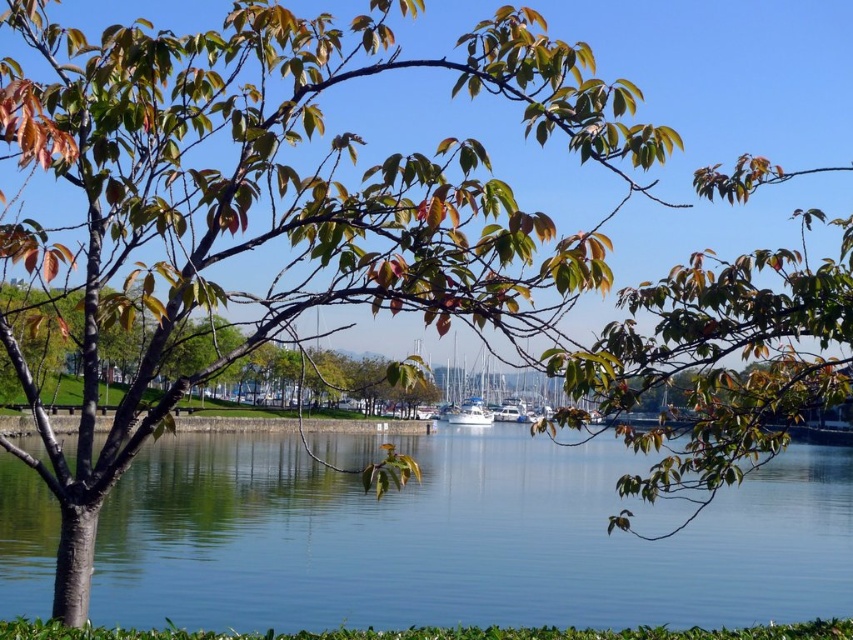
Question: Which object is the farthest from the green matte tree at center?

Choices:
 (A) clear blue water at center
 (B) white glossy boat at center

Answer: (A)

Question: Does clear blue water at center have a larger size compared to white glossy boat at center?

Choices:
 (A) yes
 (B) no

Answer: (A)

Question: Which object is farther from the camera taking this photo?

Choices:
 (A) green matte tree at center
 (B) white glossy boat at center

Answer: (B)

Question: Can you confirm if clear blue water at center is positioned to the left of green matte tree at center?

Choices:
 (A) no
 (B) yes

Answer: (A)

Question: Which object is positioned closest to the white glossy boat at center?

Choices:
 (A) clear blue water at center
 (B) green matte tree at center

Answer: (A)

Question: Does green matte tree at center have a smaller size compared to white glossy boat at center?

Choices:
 (A) no
 (B) yes

Answer: (A)